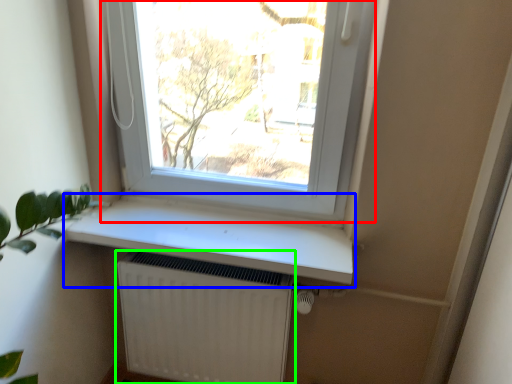
Question: Based on their relative distances, which object is nearer to window (highlighted by a red box)? Choose from window sill (highlighted by a blue box) and radiator (highlighted by a green box).

Choices:
 (A) window sill
 (B) radiator

Answer: (A)